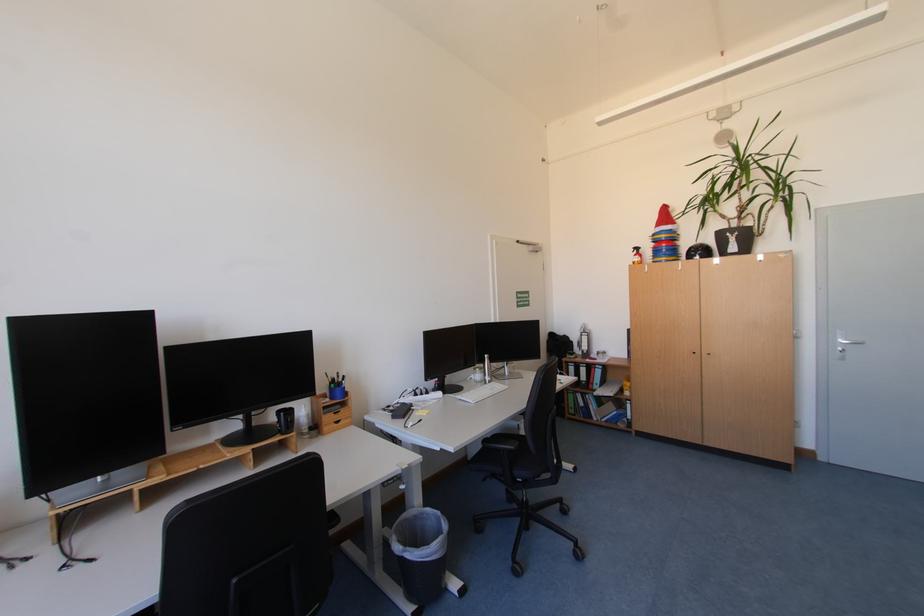
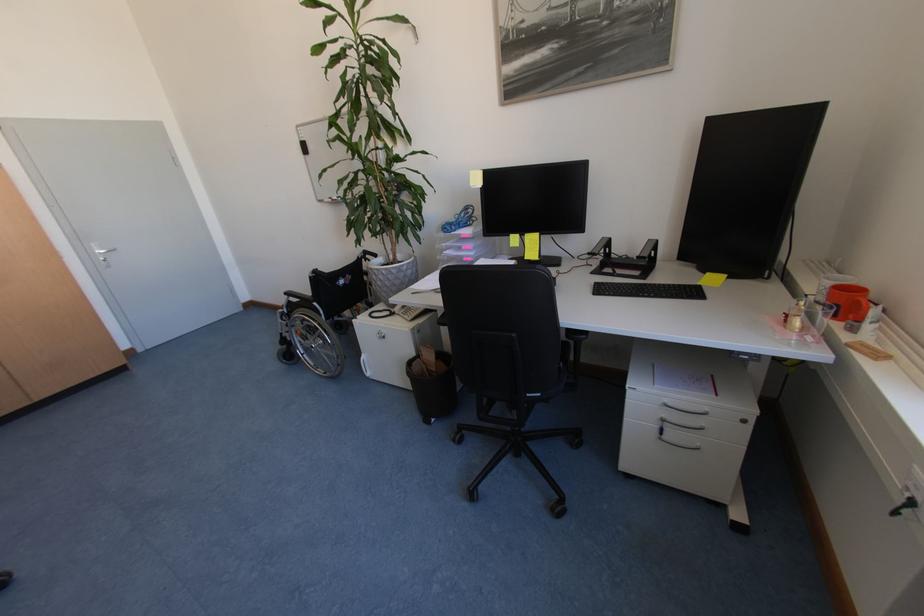
The first image is from the beginning of the video and the second image is from the end. How did the camera likely rotate when shooting the video?

The camera's rotation is toward right-down.